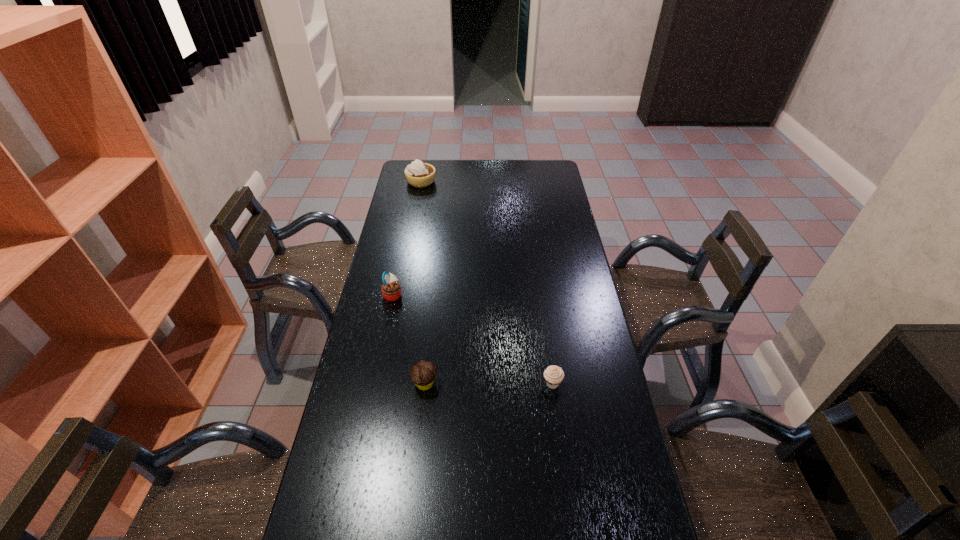
Image resolution: width=960 pixels, height=540 pixels. Identify the location of whipped cream located in the left edge section of the desktop. (418, 174).

You are a GUI agent. You are given a task and a screenshot of the screen. Output one action in this format:
    pyautogui.click(x=<x>, y=<y>)
    Task: Click on the muffin at the left edge
    This screenshot has height=540, width=960.
    Given the screenshot: What is the action you would take?
    pyautogui.click(x=391, y=290)

Identify the location of object that is positioned at the right edge. (554, 375).

You are a GUI agent. You are given a task and a screenshot of the screen. Output one action in this format:
    pyautogui.click(x=<x>, y=<y>)
    Task: Click on the object that is at the far left corner
    This screenshot has height=540, width=960.
    Given the screenshot: What is the action you would take?
    (418, 174)

Locate an element on the screen. Image resolution: width=960 pixels, height=540 pixels. blank space at the far edge is located at coordinates (484, 178).

The width and height of the screenshot is (960, 540). What are the coordinates of `free point at the left edge` in the screenshot? It's located at (420, 202).

Locate an element on the screen. The height and width of the screenshot is (540, 960). free region at the right edge of the desktop is located at coordinates (561, 361).

Find the location of `free space between the second muffin from right to left and the leftmost muffin`. free space between the second muffin from right to left and the leftmost muffin is located at coordinates (409, 339).

This screenshot has width=960, height=540. Find the location of `unoccupied area between the second object from right to left and the rightmost object`. unoccupied area between the second object from right to left and the rightmost object is located at coordinates (489, 383).

At what (x,y) coordinates should I click in order to perform the action: click on free spot between the second muffin from left to right and the rightmost muffin. Please return your answer as a coordinate pair (x, y). Looking at the image, I should click on (489, 383).